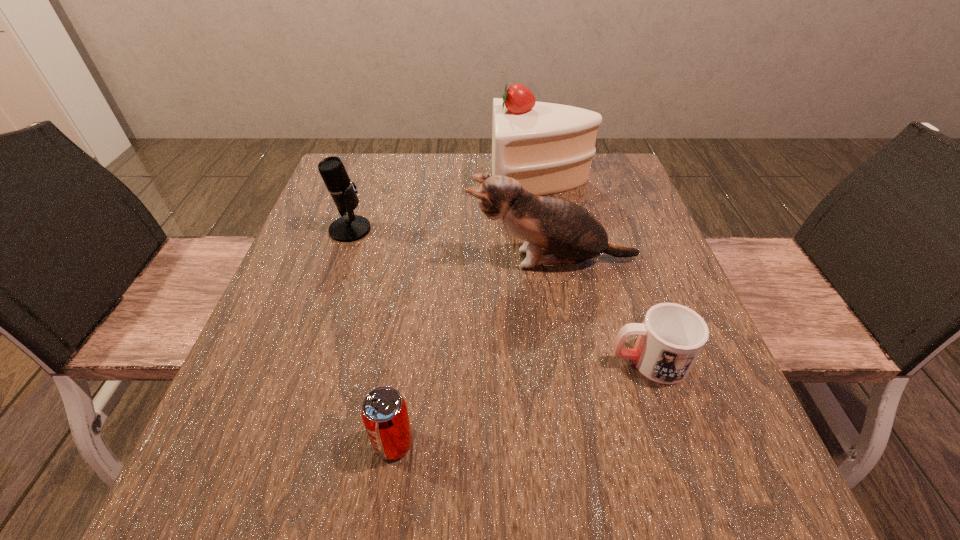
Find the location of `object at the left edge`. object at the left edge is located at coordinates (348, 228).

The height and width of the screenshot is (540, 960). What are the coordinates of `cake that is at the right edge` in the screenshot? It's located at (548, 148).

Where is `cat present at the right edge`? This screenshot has height=540, width=960. cat present at the right edge is located at coordinates (556, 231).

Find the location of a particular element. The height and width of the screenshot is (540, 960). mug located in the right edge section of the desktop is located at coordinates [670, 339].

Image resolution: width=960 pixels, height=540 pixels. Find the location of `object situated at the far right corner`. object situated at the far right corner is located at coordinates (548, 148).

This screenshot has width=960, height=540. I want to click on vacant space at the far edge of the desktop, so (402, 178).

This screenshot has height=540, width=960. Find the location of `free space at the near edge`. free space at the near edge is located at coordinates (625, 465).

Image resolution: width=960 pixels, height=540 pixels. Find the location of `blank space at the left edge of the desktop`. blank space at the left edge of the desktop is located at coordinates (373, 207).

Locate an element on the screen. Image resolution: width=960 pixels, height=540 pixels. vacant space at the right edge of the desktop is located at coordinates (632, 222).

In the image, there is a desktop. Find the location of `vacant space at the far left corner`. vacant space at the far left corner is located at coordinates (346, 168).